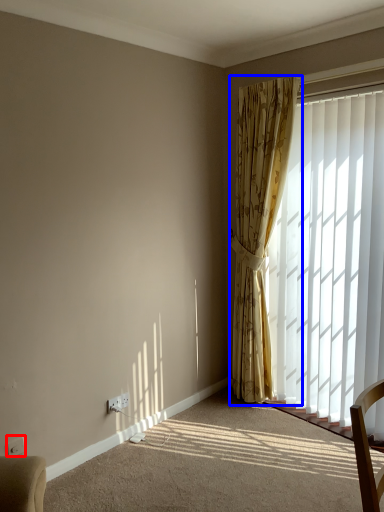
Question: Which of the following is the closest to the observer, electric outlet (highlighted by a red box) or curtain (highlighted by a blue box)?

Choices:
 (A) electric outlet
 (B) curtain

Answer: (A)